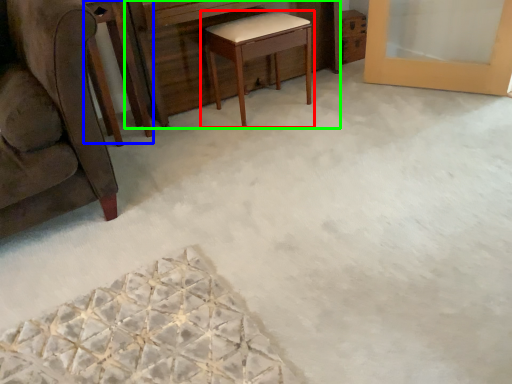
Question: Which object is positioned closest to table (highlighted by a red box)? Select from round table (highlighted by a blue box) and vanity (highlighted by a green box).

Choices:
 (A) round table
 (B) vanity

Answer: (B)